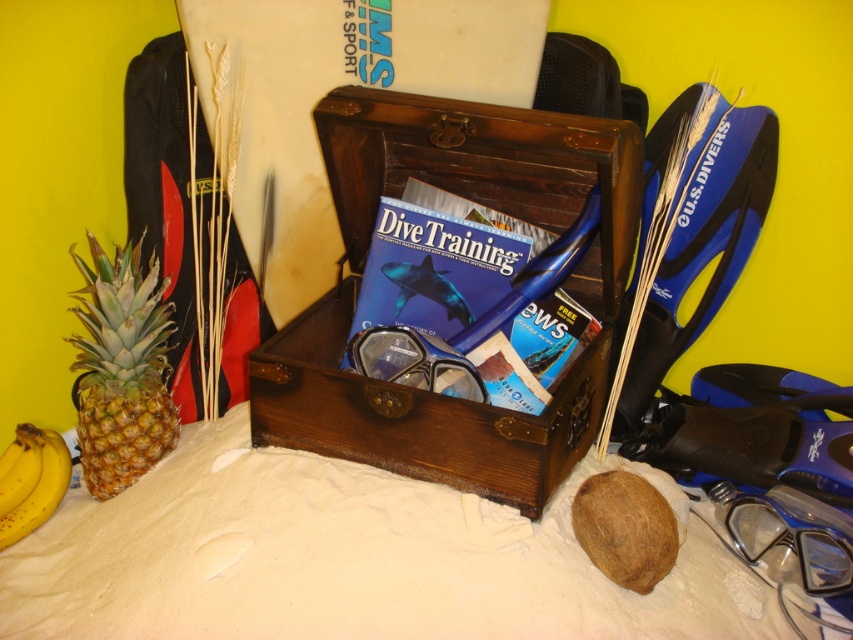
You are a scuba diver preparing for a dive and need to place your yellow textured pineapple at left into the open wooden treasure chest in the center. Can you determine if the pineapple will fit inside the chest?

The pineapple and the chest are 3.38 feet apart. Since the distance between them is greater than the size of the pineapple, it is possible to place the pineapple into the chest if the chest is large enough. However, the description does not provide the dimensions of the chest itself, so we cannot confirm if the pineapple will fit based on the given information.

You are an adventurer looking for your diving gear. You see the clear plastic goggles at center and the yellow matte bananas at lower left. Which item is positioned to the right side of the scene?

The clear plastic goggles at center are positioned to the right of the yellow matte bananas at lower left, so the clear plastic goggles at center are on the right side of the scene.

You are organizing a tropical fruit display and need to place the yellow textured pineapple at left and yellow matte bananas at lower left. According to the scene, which fruit is positioned further to the right?

The yellow textured pineapple at left is positioned to the right of the yellow matte bananas at lower left, so the pineapple is further to the right.